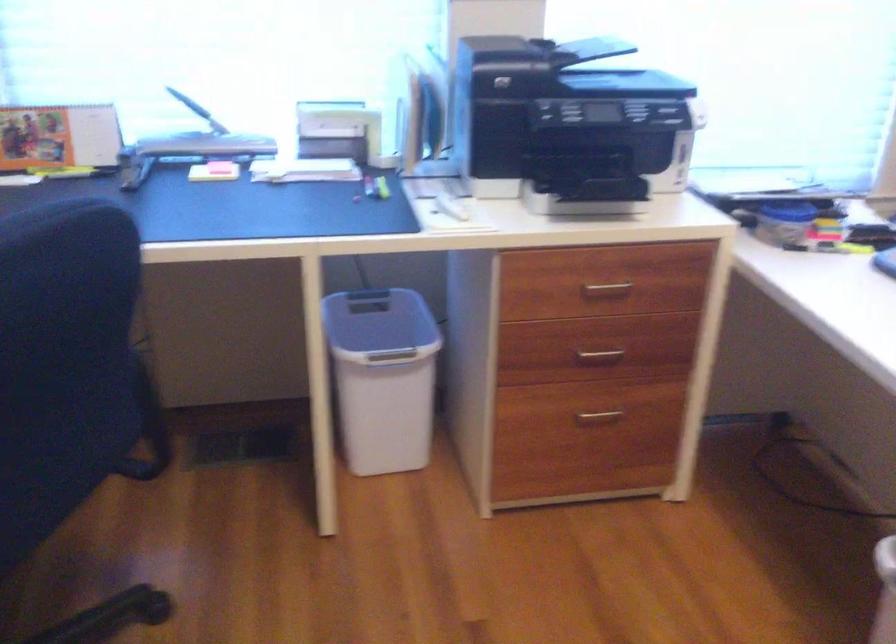
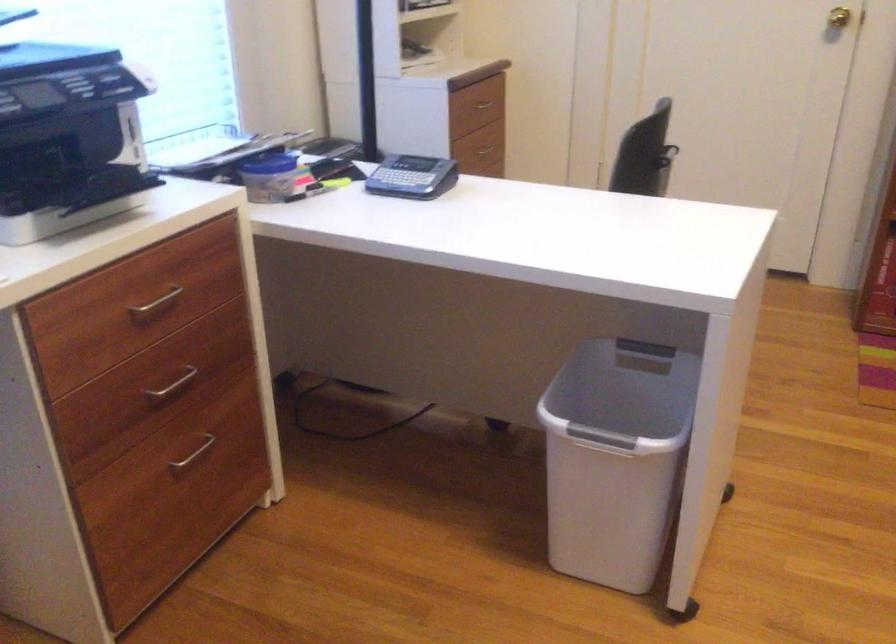
Where in the second image is the point corresponding to (599,353) from the first image?

(173, 384)